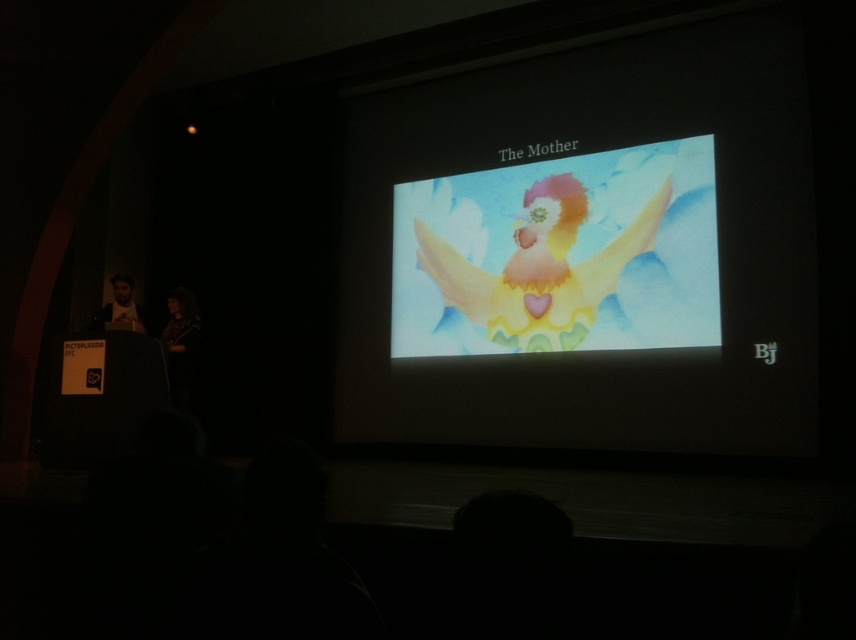
Based on the photo, is matte black jacket at lower left taller than beige fabric speaker at left?

Yes, matte black jacket at lower left is taller than beige fabric speaker at left.

This screenshot has height=640, width=856. What do you see at coordinates (180, 321) in the screenshot?
I see `matte black jacket at lower left` at bounding box center [180, 321].

Is point (177, 352) farther from camera compared to point (135, 321)?

Yes, it is behind point (135, 321).

You are a GUI agent. You are given a task and a screenshot of the screen. Output one action in this format:
    pyautogui.click(x=<x>, y=<y>)
    Task: Click on the matte black jacket at lower left
    This screenshot has height=640, width=856.
    Given the screenshot: What is the action you would take?
    pyautogui.click(x=180, y=321)

Which of these two, pastel watercolor angel at center or matte black jacket at lower left, stands shorter?

With less height is matte black jacket at lower left.

The height and width of the screenshot is (640, 856). Describe the element at coordinates (559, 256) in the screenshot. I see `pastel watercolor angel at center` at that location.

Image resolution: width=856 pixels, height=640 pixels. In order to click on pastel watercolor angel at center in this screenshot , I will do `click(559, 256)`.

Is pastel watercolor angel at center thinner than beige fabric speaker at left?

No.

The image size is (856, 640). What do you see at coordinates (559, 256) in the screenshot? I see `pastel watercolor angel at center` at bounding box center [559, 256].

Identify the location of pastel watercolor angel at center. (559, 256).

Locate an element on the screen. pastel watercolor angel at center is located at coordinates (559, 256).